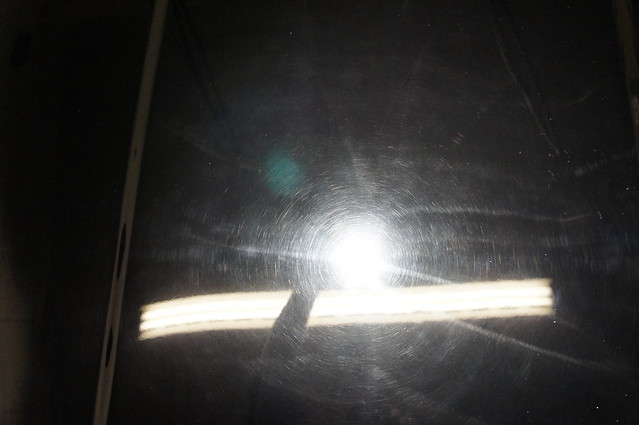
Locate an element on the screen. Image resolution: width=639 pixels, height=425 pixels. light lines is located at coordinates (181, 256), (206, 149), (403, 112), (346, 139), (450, 149), (466, 208), (429, 282), (489, 334).